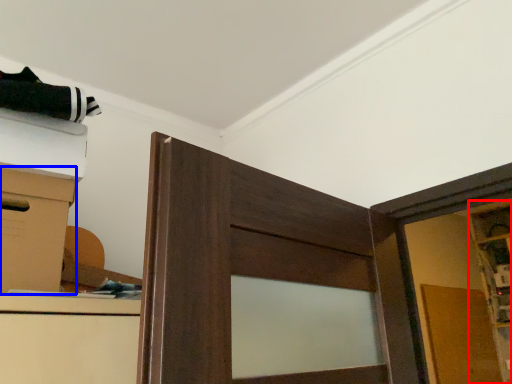
Question: Which of the following is the farthest to the observer, cabinetry (highlighted by a red box) or cardboard box (highlighted by a blue box)?

Choices:
 (A) cabinetry
 (B) cardboard box

Answer: (A)